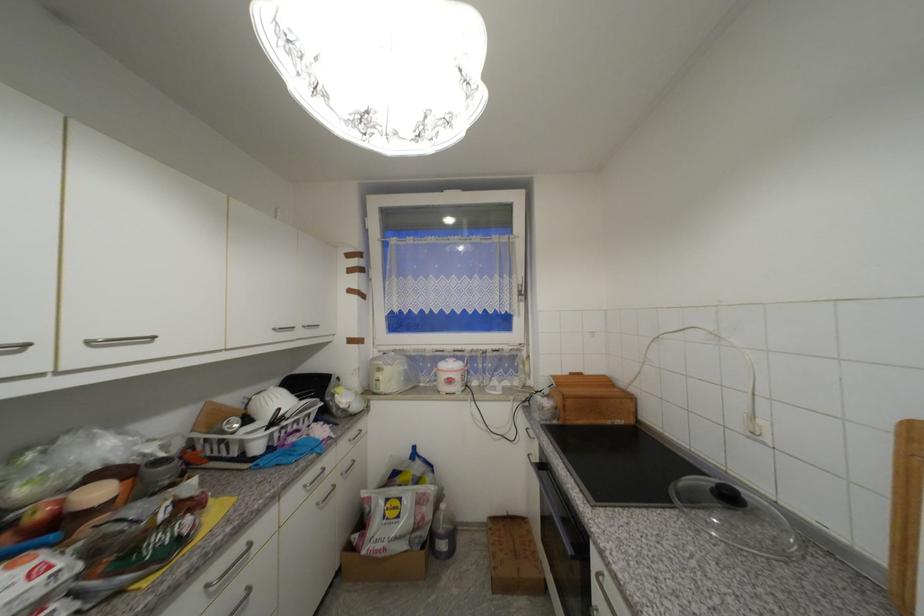
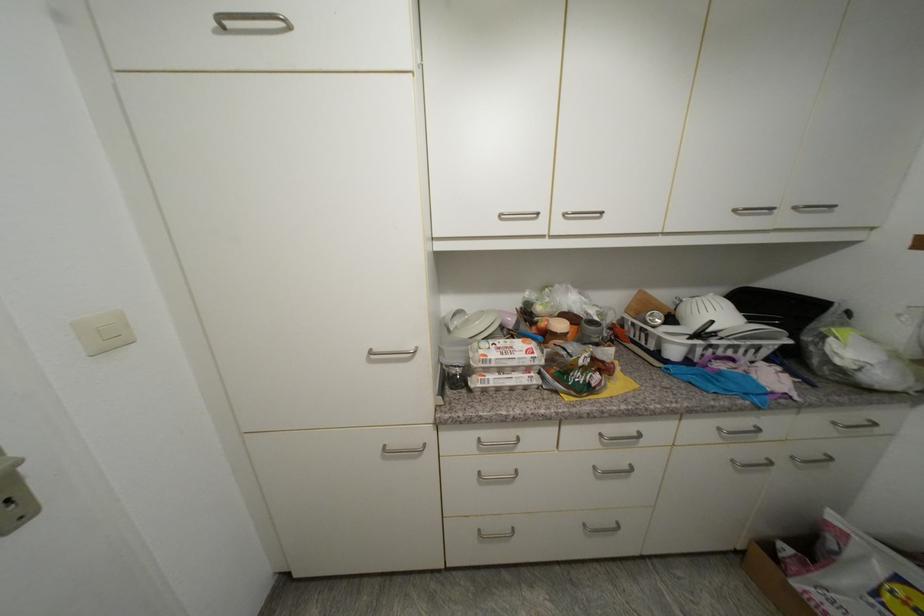
The point at (95,344) is marked in the first image. Where is the corresponding point in the second image?

(570, 216)